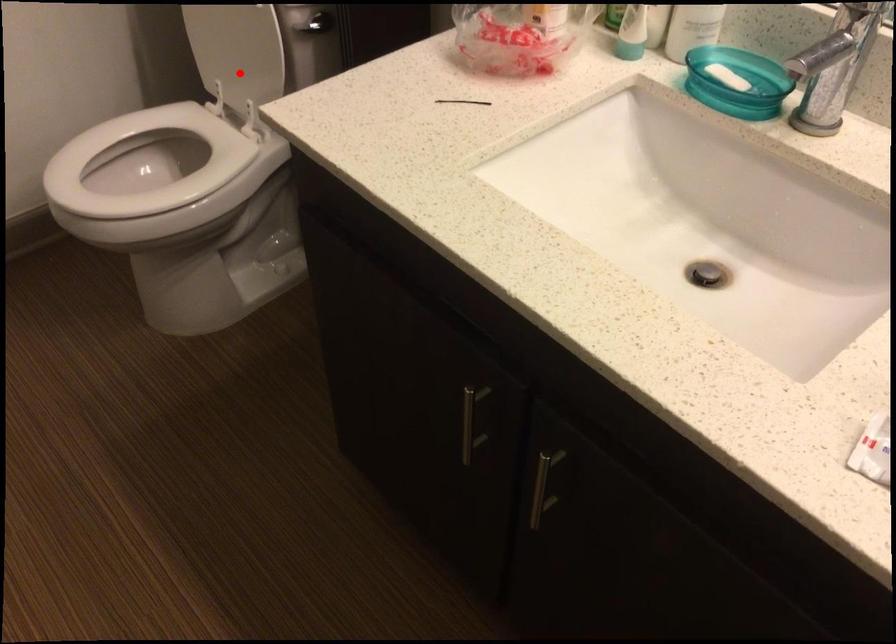
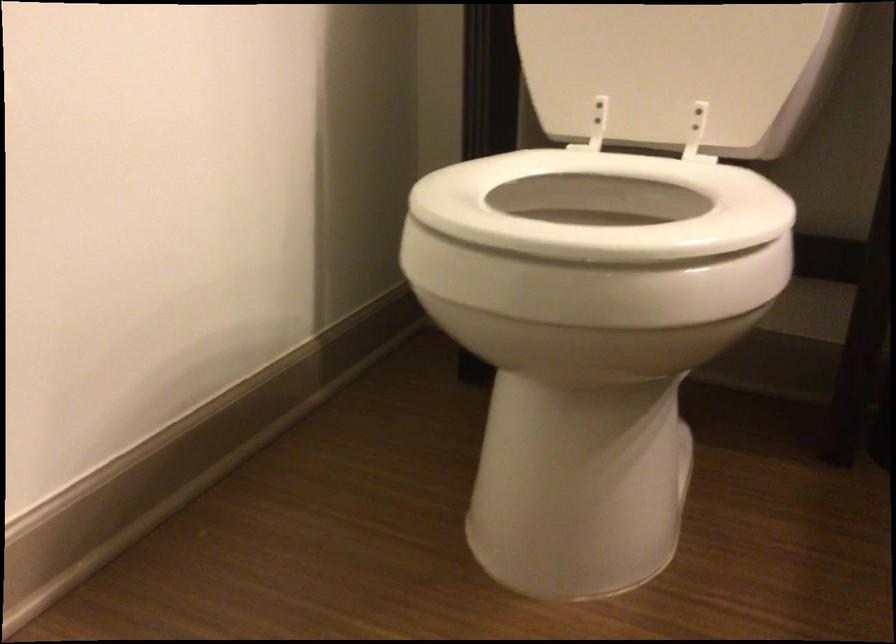
Where in the second image is the point corresponding to the highlighted location from the first image?

(677, 71)